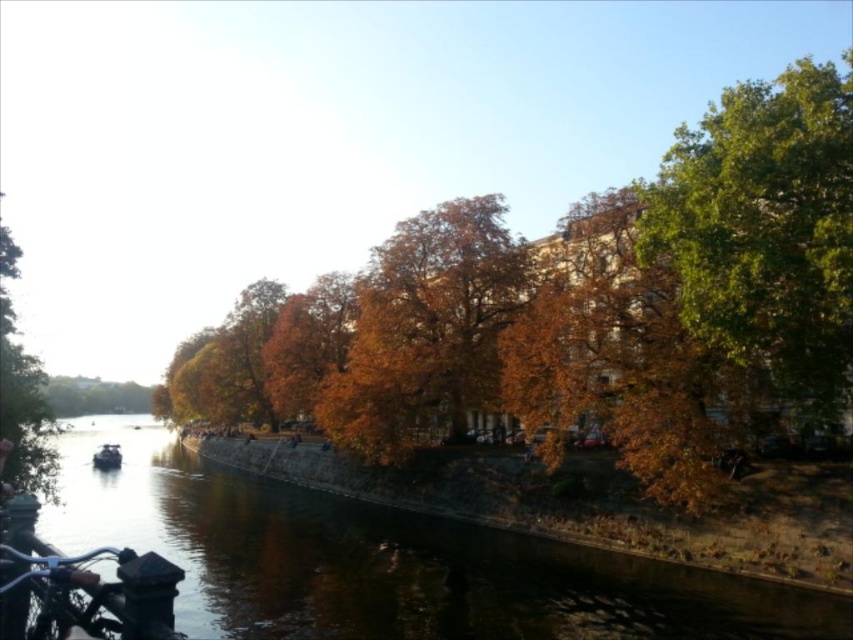
Question: Which point is closer to the camera?

Choices:
 (A) (389, 316)
 (B) (113, 486)
 (C) (111, 465)
 (D) (0, 285)

Answer: (D)

Question: Does orange leafy tree at center have a larger size compared to matte black boat at lower left?

Choices:
 (A) no
 (B) yes

Answer: (B)

Question: Considering the real-world distances, which object is farthest from the green leafy tree at left?

Choices:
 (A) green leafy tree at right
 (B) matte black boat at lower left

Answer: (B)

Question: Does orange leafy tree at center have a lesser width compared to green leafy tree at right?

Choices:
 (A) yes
 (B) no

Answer: (B)

Question: Which object is positioned closest to the brown water at center?

Choices:
 (A) orange leafy tree at center
 (B) matte black boat at lower left
 (C) green leafy tree at left
 (D) green leafy tree at right

Answer: (A)

Question: Can you confirm if orange leafy tree at center is positioned above green leafy tree at right?

Choices:
 (A) no
 (B) yes

Answer: (A)